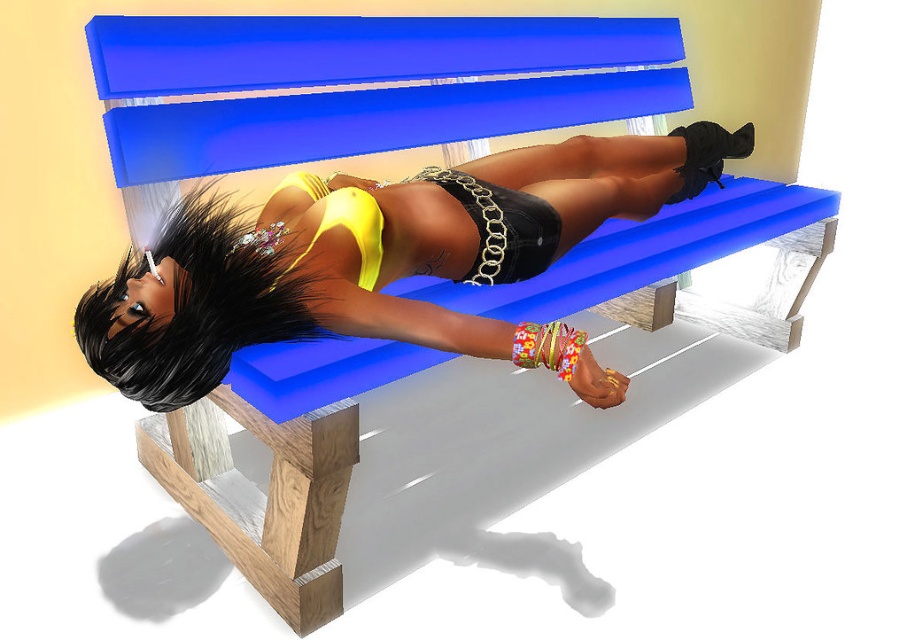
You are a photographer standing at the camera position. You want to capture a closeup shot of the yellow satin bikini top at center. Can you get within 3 feet to take the photo?

The yellow satin bikini top at center and camera are 3.59 feet apart from each other, so yes, you can get within 3 feet to take the photo since the distance is greater than 3 feet.

You are a photographer setting up a shot of the person on the blue bench. You want to focus on the matte yellow bikini top at center while keeping the entire bench in frame. Given the camera is positioned at a standard height, will the top be in focus if the bench is 40 inches long?

The matte yellow bikini top at center is 38.52 inches away from the camera, which is within the 40 inch length of the bench. Therefore, the top will be in focus while the entire bench remains in frame.